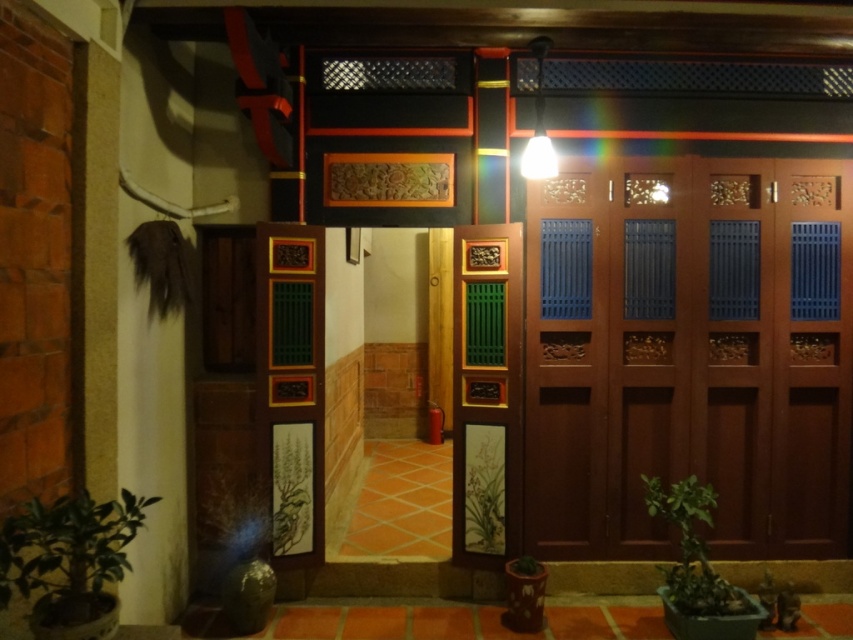
Can you confirm if green matte plant at lower left is wider than green matte painting at center?

Yes, green matte plant at lower left is wider than green matte painting at center.

Is green matte plant at lower left positioned at the back of green matte painting at center?

No.

At what (x,y) coordinates should I click in order to perform the action: click on green matte plant at lower left. Please return your answer as a coordinate pair (x, y). This screenshot has height=640, width=853. Looking at the image, I should click on (68, 561).

Between wooden carved door at center and green matte painting at center, which one has more height?

wooden carved door at center

Is wooden carved door at center to the left of green matte painting at center from the viewer's perspective?

No, wooden carved door at center is not to the left of green matte painting at center.

Does point (465, 294) lie behind point (486, 460)?

Yes.

Locate an element on the screen. This screenshot has height=640, width=853. wooden carved door at center is located at coordinates (486, 394).

Is green leafy plant at lower right positioned in front of green matte painting at center?

That is True.

Can you confirm if green leafy plant at lower right is thinner than green matte painting at center?

No.

I want to click on green leafy plant at lower right, so click(x=691, y=548).